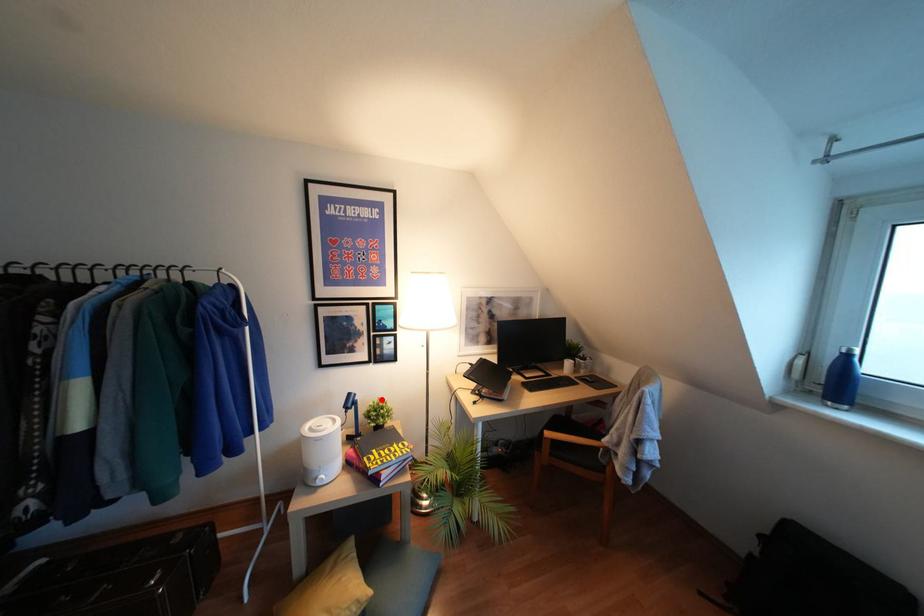
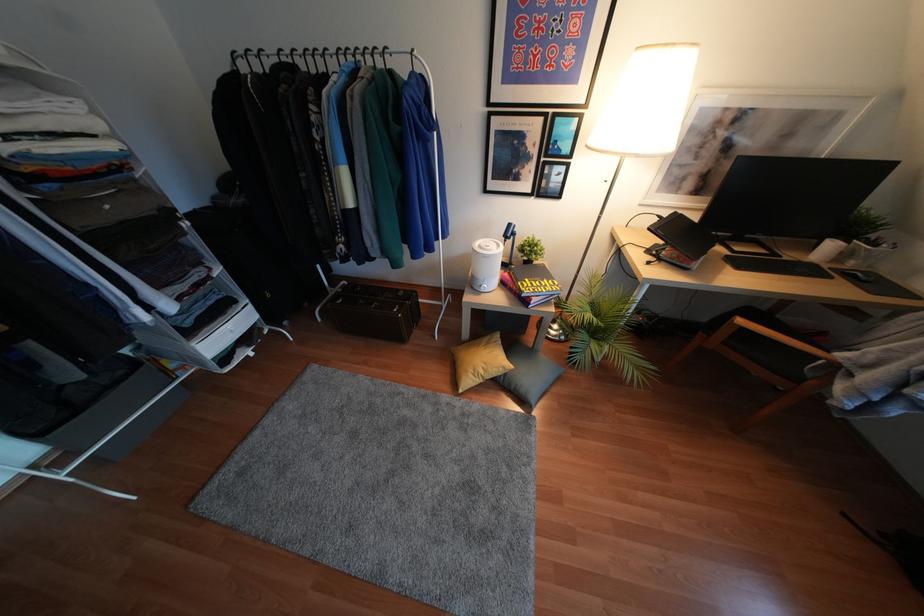
Where in the second image is the point corresponding to the highlighted location from the first image?

(536, 237)